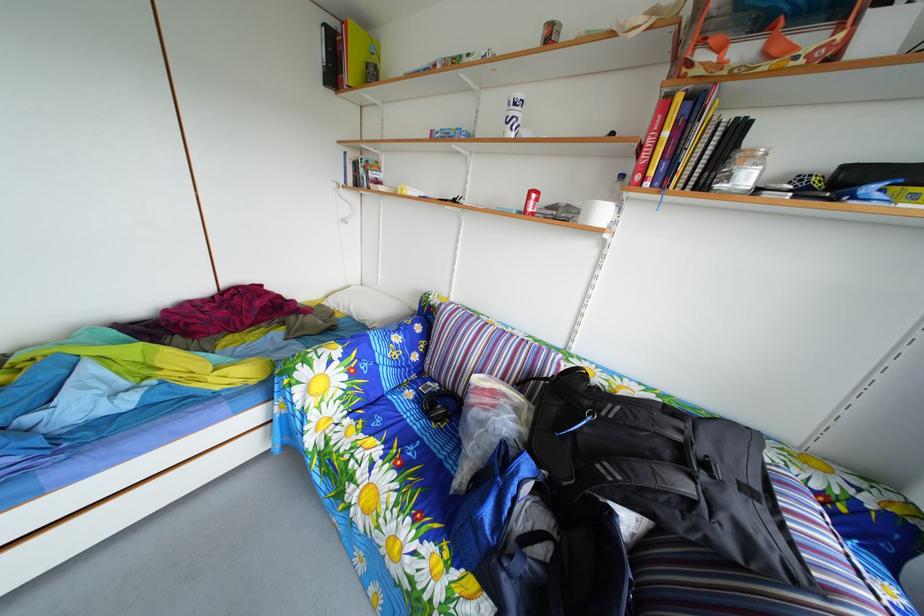
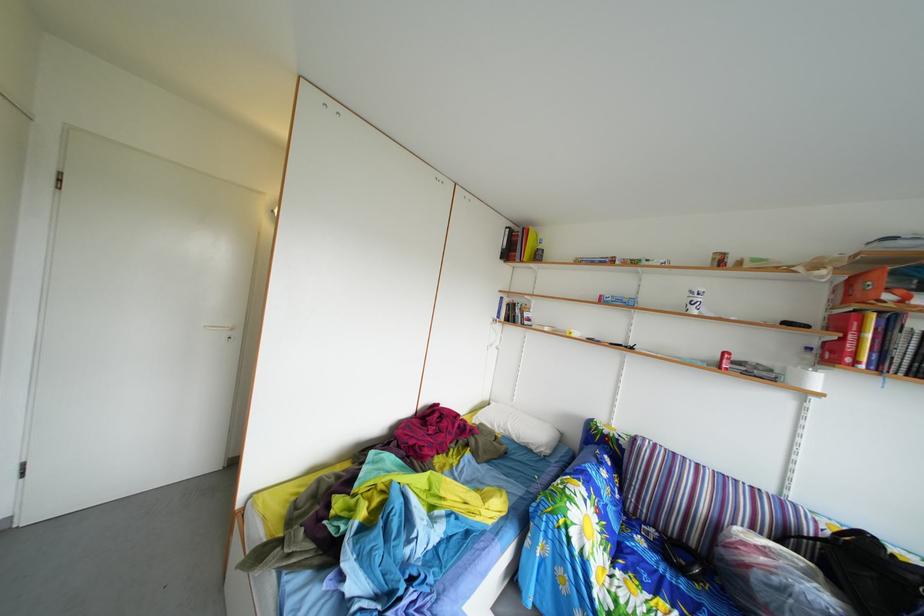
In a continuous first-person perspective shot, in which direction is the camera moving?

The cameraman moved toward left, backward.